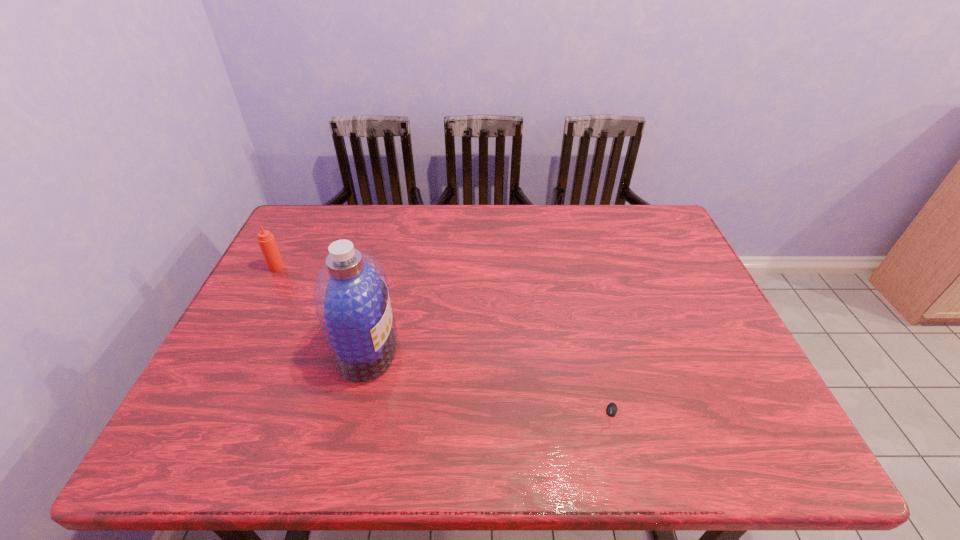
In order to click on object positioned at the left edge in this screenshot , I will do `click(266, 240)`.

This screenshot has height=540, width=960. Find the location of `free space at the far edge of the desktop`. free space at the far edge of the desktop is located at coordinates (567, 211).

The height and width of the screenshot is (540, 960). Find the location of `blank space at the left edge of the desktop`. blank space at the left edge of the desktop is located at coordinates (305, 308).

The width and height of the screenshot is (960, 540). I want to click on vacant area at the right edge, so click(x=689, y=295).

The height and width of the screenshot is (540, 960). I want to click on vacant position at the near left corner of the desktop, so click(x=197, y=444).

This screenshot has height=540, width=960. Find the location of `vacant area at the far right corner of the desktop`. vacant area at the far right corner of the desktop is located at coordinates (660, 244).

The image size is (960, 540). In order to click on free space between the leftmost object and the rightmost object in this screenshot , I will do `click(443, 342)`.

Identify the location of free space between the nearest object and the tallest object. (488, 383).

Locate an element on the screen. The width and height of the screenshot is (960, 540). free space between the cleansing agent and the shortest object is located at coordinates (488, 383).

Image resolution: width=960 pixels, height=540 pixels. I want to click on vacant area between the leftmost object and the shortest object, so click(443, 342).